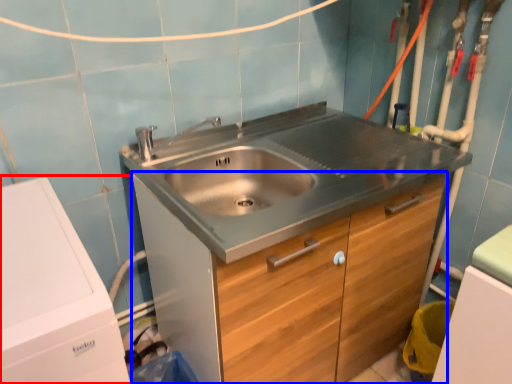
Question: Which point is closer to the camera, washing machine (highlighted by a red box) or cabinetry (highlighted by a blue box)?

Choices:
 (A) washing machine
 (B) cabinetry

Answer: (A)